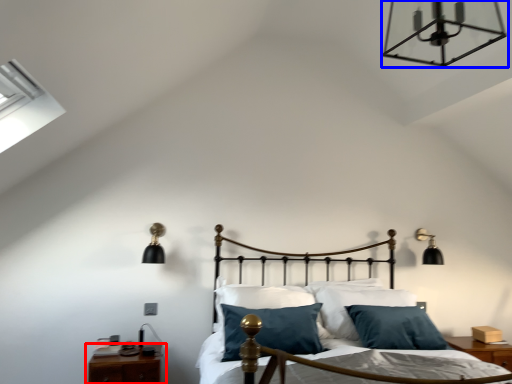
Question: Which of the following is the closest to the observer, nightstand (highlighted by a red box) or lamp (highlighted by a blue box)?

Choices:
 (A) nightstand
 (B) lamp

Answer: (B)